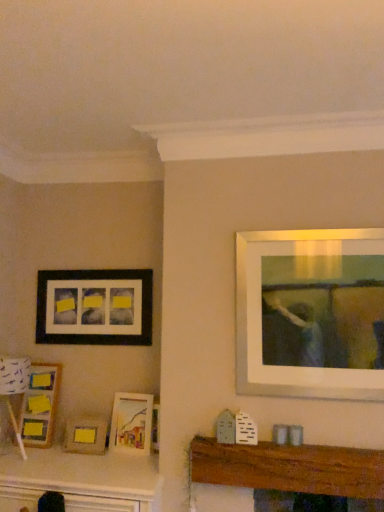
What do you see at coordinates (14, 374) in the screenshot? I see `white paper lampshade at lower left` at bounding box center [14, 374].

Find the location of a particular element. The image size is (384, 512). wooden mantel at center is located at coordinates (289, 468).

The height and width of the screenshot is (512, 384). What do you see at coordinates (94, 307) in the screenshot?
I see `matte black picture frame at left, placed as the fourth picture frame when sorted from bottom to top` at bounding box center [94, 307].

Locate an element on the screen. white paper lampshade at lower left is located at coordinates (14, 374).

Can white paper lampshade at lower left be found inside matte wooden picture frame at center, acting as the 3th picture frame starting from the top?

Actually, white paper lampshade at lower left is outside matte wooden picture frame at center, acting as the 3th picture frame starting from the top.

Are matte wooden picture frame at center, the 2th picture frame when ordered from bottom to top, and white paper lampshade at lower left located far from each other?

Actually, matte wooden picture frame at center, the 2th picture frame when ordered from bottom to top, and white paper lampshade at lower left are a little close together.

Is matte wooden picture frame at center, acting as the 3th picture frame starting from the top, facing away from white paper lampshade at lower left?

matte wooden picture frame at center, acting as the 3th picture frame starting from the top, is not turned away from white paper lampshade at lower left.

Does matte wooden picture frame at center, acting as the 3th picture frame starting from the top, appear on the right side of white paper lampshade at lower left?

Yes.

How distant is wooden mantel at center from wooden picture frame at lower left, acting as the 2th picture frame starting from the top?

The distance of wooden mantel at center from wooden picture frame at lower left, acting as the 2th picture frame starting from the top, is 4.34 feet.

Is wooden mantel at center with wooden picture frame at lower left, acting as the 2th picture frame starting from the top?

No, wooden mantel at center is not next to wooden picture frame at lower left, acting as the 2th picture frame starting from the top.

Is wooden picture frame at lower left, acting as the 2th picture frame starting from the top, inside wooden mantel at center?

No.

How many degrees apart are the facing directions of wooden mantel at center and wooden picture frame at lower left, acting as the 2th picture frame starting from the top?

The angular difference between wooden mantel at center and wooden picture frame at lower left, acting as the 2th picture frame starting from the top, is 0.0733 degrees.

From a real-world perspective, is white paper lampshade at lower left under wooden picture frame at lower left, acting as the 2th picture frame starting from the top?

No, from a real-world perspective, white paper lampshade at lower left is not under wooden picture frame at lower left, acting as the 2th picture frame starting from the top.

Which is more to the left, white paper lampshade at lower left or wooden picture frame at lower left, which ranks as the 3th picture frame in bottom-to-top order?

From the viewer's perspective, white paper lampshade at lower left appears more on the left side.

Looking at their sizes, would you say white paper lampshade at lower left is wider or thinner than wooden picture frame at lower left, which ranks as the 3th picture frame in bottom-to-top order?

Clearly, white paper lampshade at lower left has more width compared to wooden picture frame at lower left, which ranks as the 3th picture frame in bottom-to-top order.

From the image's perspective, which picture frame is the 1st one below the white paper lampshade at lower left? Please provide its 2D coordinates.

[(40, 405)]

Which is behind, wooden mantel at center or white paper lampshade at lower left?

white paper lampshade at lower left is further away from the camera.

Does point (354, 484) lie in front of point (14, 380)?

Yes.

Is white paper lampshade at lower left surrounded by wooden mantel at center?

Definitely not — white paper lampshade at lower left is not inside wooden mantel at center.

Considering the sizes of wooden mantel at center and white paper lampshade at lower left in the image, is wooden mantel at center taller or shorter than white paper lampshade at lower left?

Clearly, wooden mantel at center is shorter compared to white paper lampshade at lower left.

Considering the sizes of objects matte yellow picture frame at lower left, the 4th picture frame positioned from the top, and wooden picture frame at lower left, which ranks as the 3th picture frame in bottom-to-top order, in the image provided, who is thinner, matte yellow picture frame at lower left, the 4th picture frame positioned from the top, or wooden picture frame at lower left, which ranks as the 3th picture frame in bottom-to-top order,?

With smaller width is matte yellow picture frame at lower left, the 4th picture frame positioned from the top.

Does matte yellow picture frame at lower left, the 4th picture frame positioned from the top, have a lesser height compared to wooden picture frame at lower left, which ranks as the 3th picture frame in bottom-to-top order?

Correct, matte yellow picture frame at lower left, the 4th picture frame positioned from the top, is not as tall as wooden picture frame at lower left, which ranks as the 3th picture frame in bottom-to-top order.

From a real-world perspective, which picture frame is the 2nd one underneath the wooden picture frame at lower left, which ranks as the 3th picture frame in bottom-to-top order? Please provide its 2D coordinates.

[(85, 435)]

Considering the positions of objects matte yellow picture frame at lower left, the 4th picture frame positioned from the top, and wooden picture frame at lower left, which ranks as the 3th picture frame in bottom-to-top order, in the image provided, who is behind, matte yellow picture frame at lower left, the 4th picture frame positioned from the top, or wooden picture frame at lower left, which ranks as the 3th picture frame in bottom-to-top order,?

wooden picture frame at lower left, which ranks as the 3th picture frame in bottom-to-top order, is behind.

Considering the sizes of wooden mantel at center and matte wooden picture frame at center, acting as the 3th picture frame starting from the top, in the image, is wooden mantel at center bigger or smaller than matte wooden picture frame at center, acting as the 3th picture frame starting from the top,?

wooden mantel at center is bigger than matte wooden picture frame at center, acting as the 3th picture frame starting from the top.

From a real-world perspective, is wooden mantel at center above or below matte wooden picture frame at center, the 2th picture frame when ordered from bottom to top?

wooden mantel at center is situated lower than matte wooden picture frame at center, the 2th picture frame when ordered from bottom to top, in the real world.

Identify the location of table on the right of matte wooden picture frame at center, the 2th picture frame when ordered from bottom to top. (289, 468).

Can you confirm if wooden mantel at center is thinner than matte wooden picture frame at center, the 2th picture frame when ordered from bottom to top?

Yes, wooden mantel at center is thinner than matte wooden picture frame at center, the 2th picture frame when ordered from bottom to top.

Is wooden picture frame at lower left, acting as the 2th picture frame starting from the top, not within white paper lampshade at lower left?

wooden picture frame at lower left, acting as the 2th picture frame starting from the top, lies outside white paper lampshade at lower left's area.

This screenshot has height=512, width=384. I want to click on lamp above the wooden picture frame at lower left, which ranks as the 3th picture frame in bottom-to-top order (from a real-world perspective), so click(14, 374).

Is wooden picture frame at lower left, which ranks as the 3th picture frame in bottom-to-top order, aimed at white paper lampshade at lower left?

Yes, wooden picture frame at lower left, which ranks as the 3th picture frame in bottom-to-top order, is turned towards white paper lampshade at lower left.

I want to click on lamp to the left of matte wooden picture frame at center, the 2th picture frame when ordered from bottom to top, so click(x=14, y=374).

Find the location of a particular element. table lying below the wooden picture frame at lower left, acting as the 2th picture frame starting from the top (from the image's perspective) is located at coordinates (289, 468).

When comparing their distances from matte wooden picture frame at center, the 2th picture frame when ordered from bottom to top, does white paper lampshade at lower left or matte yellow picture frame at lower left, the 4th picture frame positioned from the top, seem further?

white paper lampshade at lower left.

Considering their positions, is matte wooden picture frame at center, acting as the 3th picture frame starting from the top, positioned further to white paper lampshade at lower left than matte yellow picture frame at lower left, placed as the 1th picture frame when sorted from bottom to top?

Among the two, matte wooden picture frame at center, acting as the 3th picture frame starting from the top, is located further to white paper lampshade at lower left.

Looking at the image, which one is located closer to white paper lampshade at lower left, matte black picture frame at left, placed as the fourth picture frame when sorted from bottom to top, or wooden picture frame at lower left, which ranks as the 3th picture frame in bottom-to-top order?

Among the two, wooden picture frame at lower left, which ranks as the 3th picture frame in bottom-to-top order, is located nearer to white paper lampshade at lower left.

Considering their positions, is matte wooden picture frame at center, the 2th picture frame when ordered from bottom to top, positioned further to matte yellow picture frame at lower left, the 4th picture frame positioned from the top, than wooden picture frame at lower left, acting as the 2th picture frame starting from the top?

wooden picture frame at lower left, acting as the 2th picture frame starting from the top, is further to matte yellow picture frame at lower left, the 4th picture frame positioned from the top.

Based on their spatial positions, is white paper lampshade at lower left or wooden picture frame at lower left, which ranks as the 3th picture frame in bottom-to-top order, further from matte yellow picture frame at lower left, placed as the 1th picture frame when sorted from bottom to top?

The object further to matte yellow picture frame at lower left, placed as the 1th picture frame when sorted from bottom to top, is white paper lampshade at lower left.

Considering their positions, is white paper lampshade at lower left positioned further to matte black picture frame at left, which appears as the first picture frame when viewed from the top, than wooden picture frame at lower left, which ranks as the 3th picture frame in bottom-to-top order?

white paper lampshade at lower left is positioned further to the anchor matte black picture frame at left, which appears as the first picture frame when viewed from the top.

Which object lies nearer to the anchor point matte black picture frame at left, which appears as the first picture frame when viewed from the top, wooden mantel at center or wooden picture frame at lower left, which ranks as the 3th picture frame in bottom-to-top order?

Among the two, wooden picture frame at lower left, which ranks as the 3th picture frame in bottom-to-top order, is located nearer to matte black picture frame at left, which appears as the first picture frame when viewed from the top.

Looking at this image, considering their positions, is wooden picture frame at lower left, acting as the 2th picture frame starting from the top, positioned closer to white paper lampshade at lower left than matte yellow picture frame at lower left, placed as the 1th picture frame when sorted from bottom to top?

wooden picture frame at lower left, acting as the 2th picture frame starting from the top, lies closer to white paper lampshade at lower left than the other object.

Where is `picture frame between matte black picture frame at left, which appears as the first picture frame when viewed from the top, and matte wooden picture frame at center, the 2th picture frame when ordered from bottom to top, in the up-down direction`? picture frame between matte black picture frame at left, which appears as the first picture frame when viewed from the top, and matte wooden picture frame at center, the 2th picture frame when ordered from bottom to top, in the up-down direction is located at coordinates (40, 405).

The width and height of the screenshot is (384, 512). Identify the location of picture frame between matte yellow picture frame at lower left, placed as the 1th picture frame when sorted from bottom to top, and wooden mantel at center from left to right. (131, 423).

Locate an element on the screen. This screenshot has height=512, width=384. lamp between matte black picture frame at left, placed as the fourth picture frame when sorted from bottom to top, and matte wooden picture frame at center, acting as the 3th picture frame starting from the top, in the up-down direction is located at coordinates (14, 374).

You are a GUI agent. You are given a task and a screenshot of the screen. Output one action in this format:
    pyautogui.click(x=<x>, y=<y>)
    Task: Click on the lamp between matte black picture frame at left, which appears as the first picture frame when viewed from the top, and wooden picture frame at lower left, which ranks as the 3th picture frame in bottom-to-top order, from top to bottom
    This screenshot has width=384, height=512.
    Given the screenshot: What is the action you would take?
    pyautogui.click(x=14, y=374)